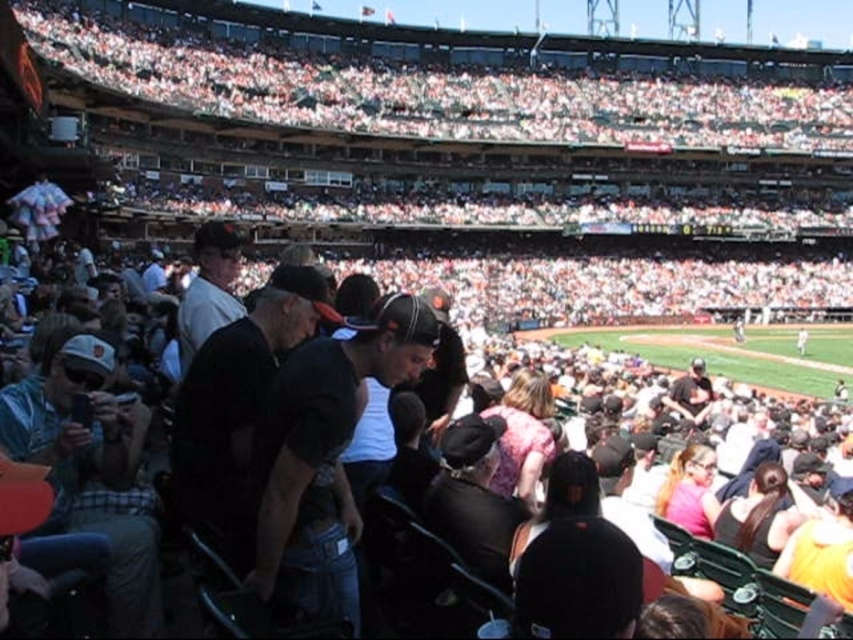
Question: Which of these objects is positioned closest to the black cotton shirt at center?

Choices:
 (A) green plaid shirt at left
 (B) black matte shirt at center

Answer: (B)

Question: Among these points, which one is nearest to the camera?

Choices:
 (A) (202, 433)
 (B) (219, 262)
 (C) (350, 362)

Answer: (A)

Question: Does dark gray baseball cap at center have a greater width compared to white t-shirt at center?

Choices:
 (A) yes
 (B) no

Answer: (B)

Question: Is green plaid shirt at left smaller than matte black baseball cap at center?

Choices:
 (A) yes
 (B) no

Answer: (A)

Question: From the image, what is the correct spatial relationship of black cotton shirt at center in relation to green plaid shirt at left?

Choices:
 (A) right
 (B) left

Answer: (A)

Question: Which of these objects is positioned closest to the matte black baseball cap at center?

Choices:
 (A) white t-shirt at center
 (B) black cotton shirt at center

Answer: (B)